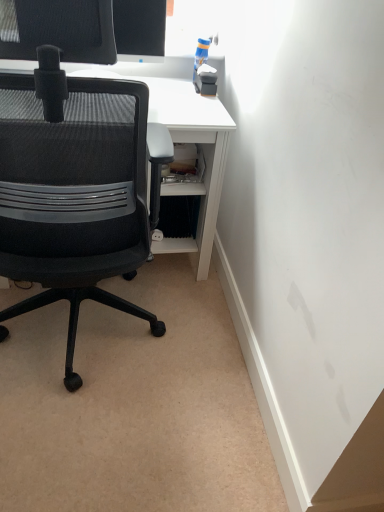
Identify the location of free spot in front of black mesh chair at left. The image size is (384, 512). (86, 442).